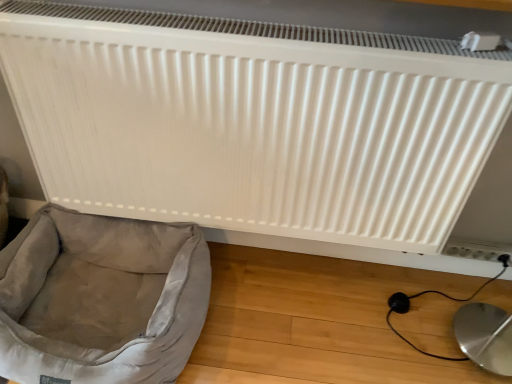
Question: From the image's perspective, is light gray fabric dog bed at lower left above or below white matte radiator at upper center?

Choices:
 (A) above
 (B) below

Answer: (B)

Question: Looking at their shapes, would you say light gray fabric dog bed at lower left is wider or thinner than white matte radiator at upper center?

Choices:
 (A) thin
 (B) wide

Answer: (B)

Question: Based on their relative distances, which object is farther from the white plastic electric outlet at lower right?

Choices:
 (A) light gray fabric dog bed at lower left
 (B) white matte radiator at upper center

Answer: (A)

Question: Which object is the farthest from the light gray fabric dog bed at lower left?

Choices:
 (A) white plastic electric outlet at lower right
 (B) white matte radiator at upper center

Answer: (A)